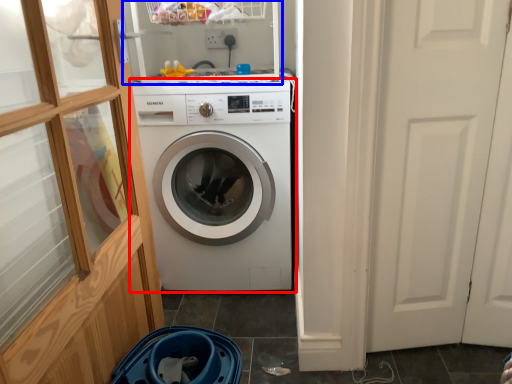
Question: Which object is closer to the camera taking this photo, washing machine (highlighted by a red box) or shelf (highlighted by a blue box)?

Choices:
 (A) washing machine
 (B) shelf

Answer: (B)